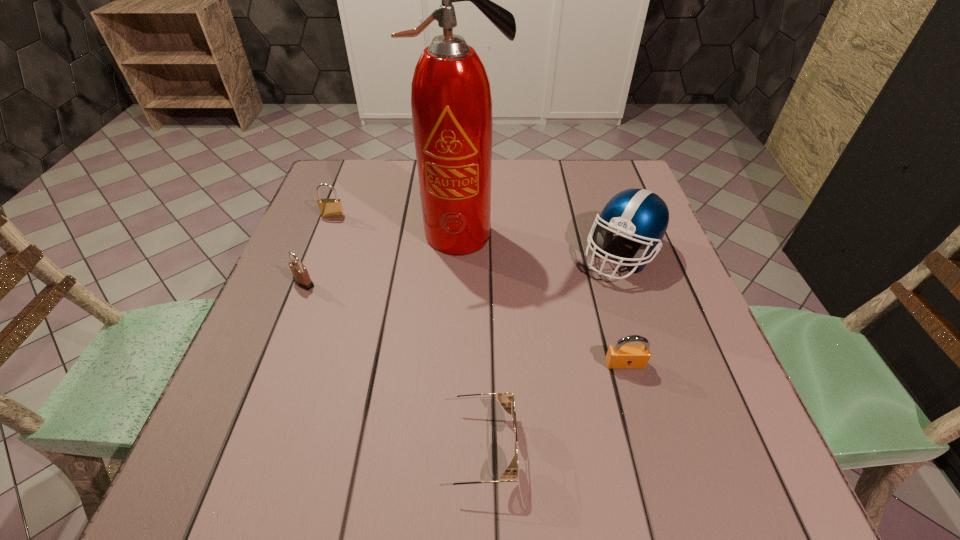
You are a GUI agent. You are given a task and a screenshot of the screen. Output one action in this format:
    pyautogui.click(x=<x>, y=<y>)
    Task: Click on the free space that satisfies the following two spatial constraints: 1. to unlock the fifth farthest object from the front; 2. on the front lenses of the shortest object
    The height and width of the screenshot is (540, 960).
    Given the screenshot: What is the action you would take?
    pyautogui.click(x=648, y=447)

Find the location of a particular element. The height and width of the screenshot is (540, 960). free spot that satisfies the following two spatial constraints: 1. to unlock the nearest padlock from the front; 2. on the front lenses of the sunglasses is located at coordinates (648, 447).